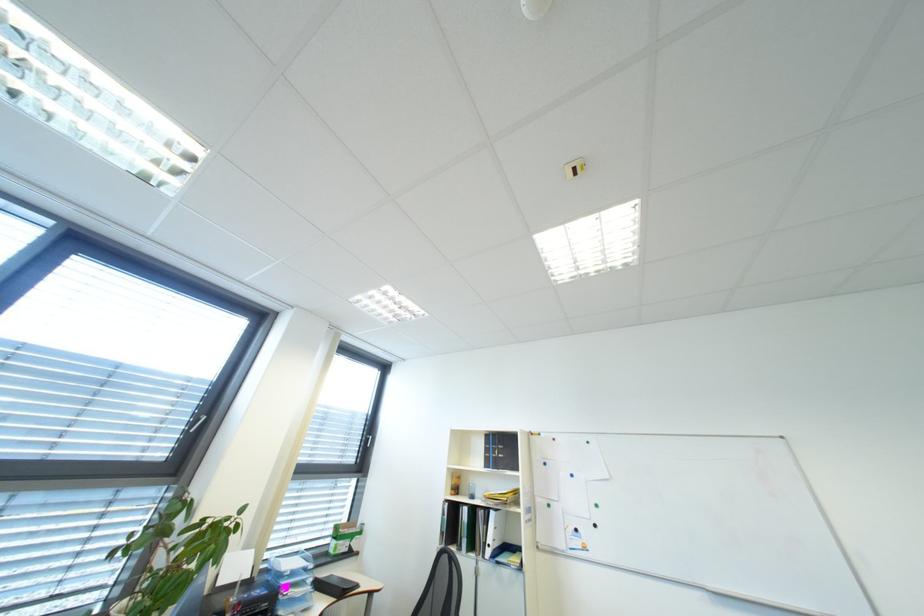
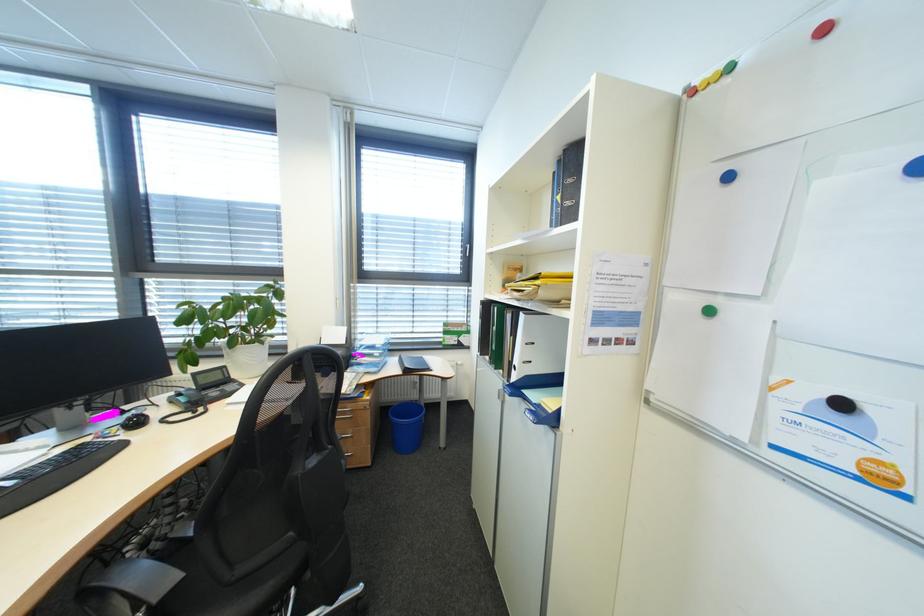
Locate, in the second image, the point that corresponds to point (327, 588) in the first image.

(411, 362)